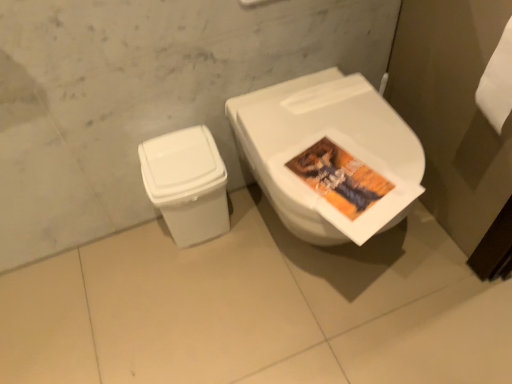
Locate an element on the screen. The height and width of the screenshot is (384, 512). vacant space underneath white glossy toilet at center (from a real-world perspective) is located at coordinates (323, 256).